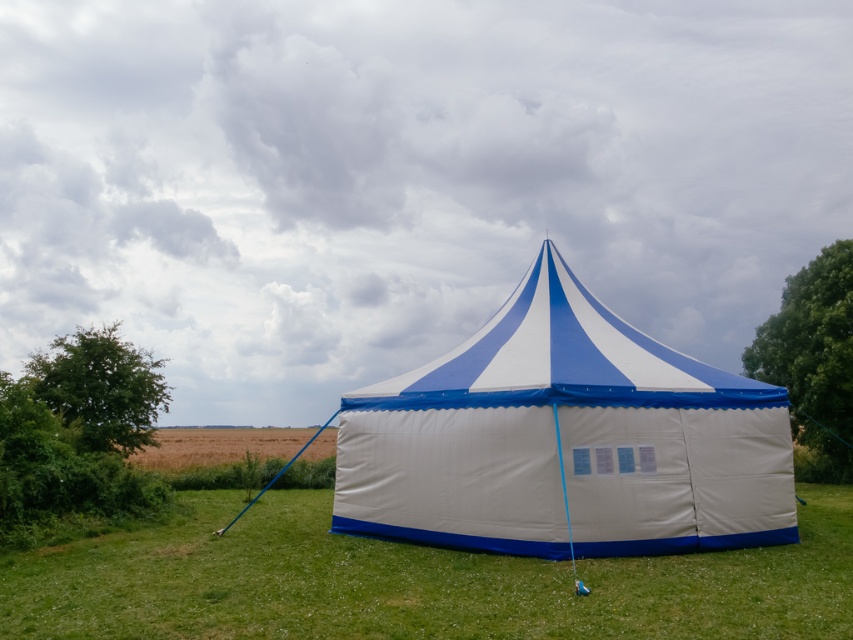
Is point (618, 497) closer to camera compared to point (292, 586)?

No.

Is blue/white striped tent at center bigger than green grass at lower center?

Actually, blue/white striped tent at center might be smaller than green grass at lower center.

The image size is (853, 640). What do you see at coordinates (564, 440) in the screenshot?
I see `blue/white striped tent at center` at bounding box center [564, 440].

Locate an element on the screen. blue/white striped tent at center is located at coordinates (564, 440).

Which is in front, point (698, 556) or point (790, 396)?

Point (698, 556) is in front.

Who is more forward, (375,627) or (808,376)?

Point (375,627) is in front.

At what (x,y) coordinates should I click in order to perform the action: click on green grass at lower center. Please return your answer as a coordinate pair (x, y). Looking at the image, I should click on (413, 580).

Who is shorter, blue/white striped tent at center or green leafy tree at left?

green leafy tree at left

Is blue/white striped tent at center further to camera compared to green leafy tree at left?

No.

The height and width of the screenshot is (640, 853). Identify the location of blue/white striped tent at center. (564, 440).

Identify the location of blue/white striped tent at center. The image size is (853, 640). (564, 440).